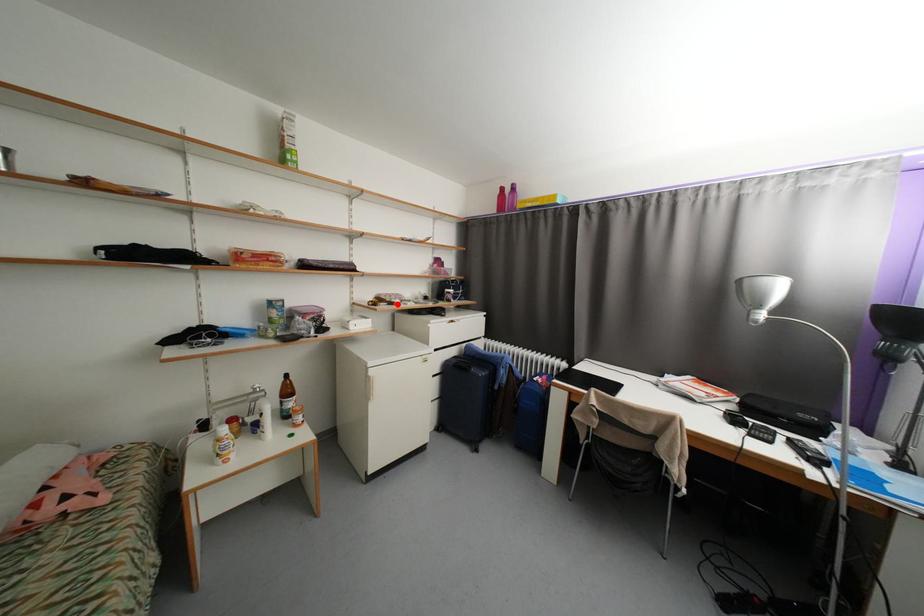
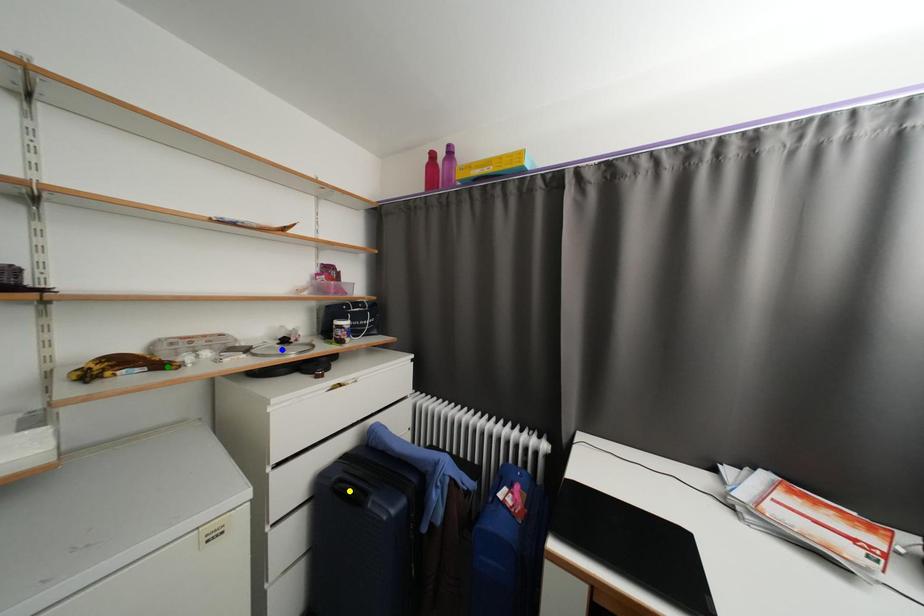
Question: I am providing you with two images of the same scene from different viewpoints. A red point is marked on the first image. You are given multiple points on the second image. Which point in image 2 is actually the same real-world point as the red point in image 1?

Choices:
 (A) yellow point
 (B) blue point
 (C) green point

Answer: (C)